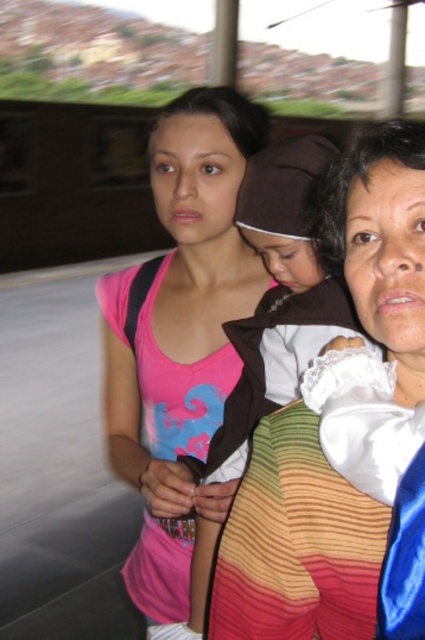
Question: Where is pink fabric at center located in relation to white lace baby at center in the image?

Choices:
 (A) right
 (B) left

Answer: (B)

Question: Which object appears farthest from the camera in this image?

Choices:
 (A) white lace baby at center
 (B) pink fabric at center

Answer: (B)

Question: Observing the image, what is the correct spatial positioning of pink fabric at center in reference to white lace baby at center?

Choices:
 (A) below
 (B) above

Answer: (B)

Question: Which of the following is the farthest from the observer?

Choices:
 (A) (240, 272)
 (B) (294, 342)

Answer: (A)

Question: Is pink fabric at center bigger than white lace baby at center?

Choices:
 (A) no
 (B) yes

Answer: (B)